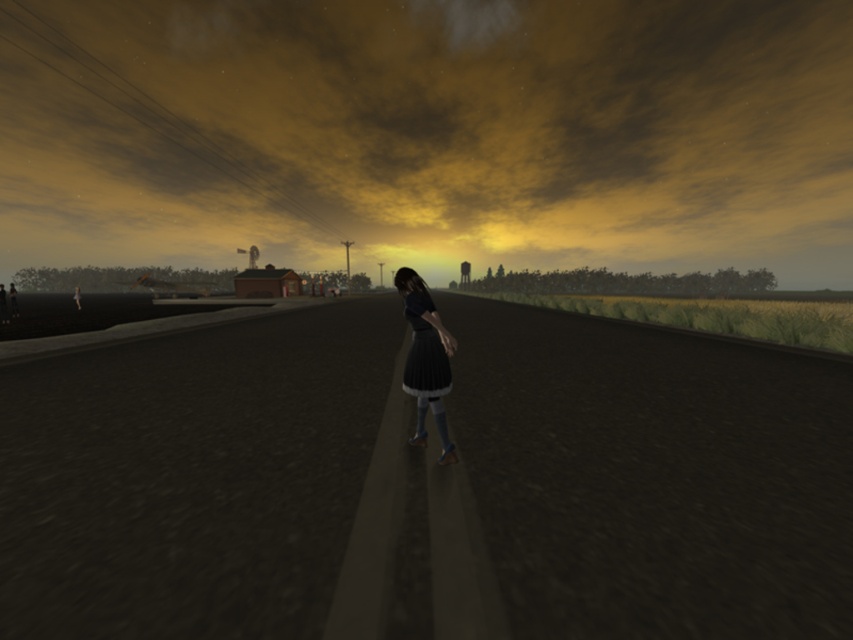
Question: Does cloudy sky at upper center appear under matte black dress at center?

Choices:
 (A) no
 (B) yes

Answer: (A)

Question: Can you confirm if black asphalt train track at center is positioned above matte black dress at center?

Choices:
 (A) no
 (B) yes

Answer: (A)

Question: Which of these objects is positioned farthest from the black asphalt train track at center?

Choices:
 (A) matte black dress at center
 (B) cloudy sky at upper center

Answer: (B)

Question: Can you confirm if black asphalt train track at center is positioned above cloudy sky at upper center?

Choices:
 (A) yes
 (B) no

Answer: (B)

Question: Based on their relative distances, which object is farther from the matte black dress at center?

Choices:
 (A) black asphalt train track at center
 (B) cloudy sky at upper center

Answer: (B)

Question: Among these points, which one is farthest from the camera?

Choices:
 (A) (78, 380)
 (B) (427, 291)

Answer: (B)